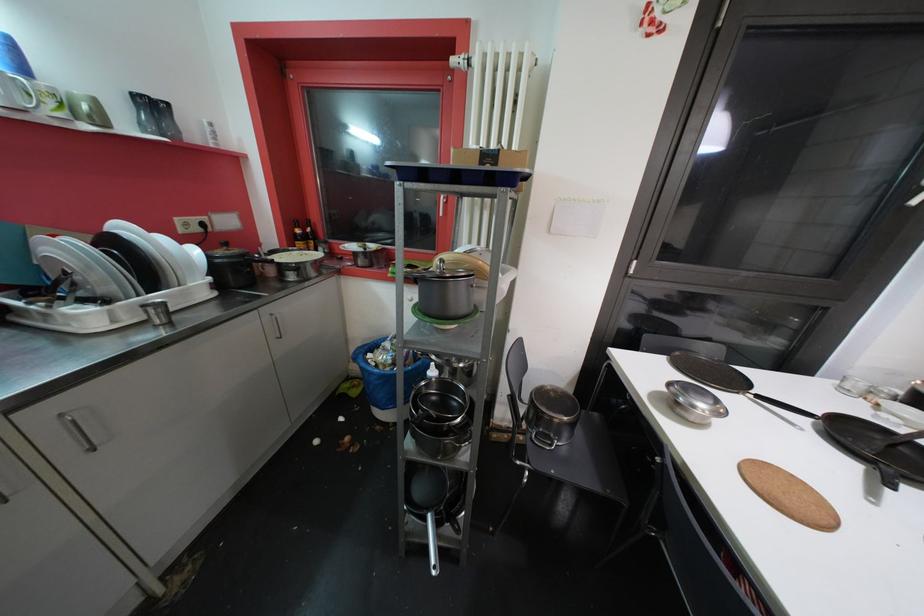
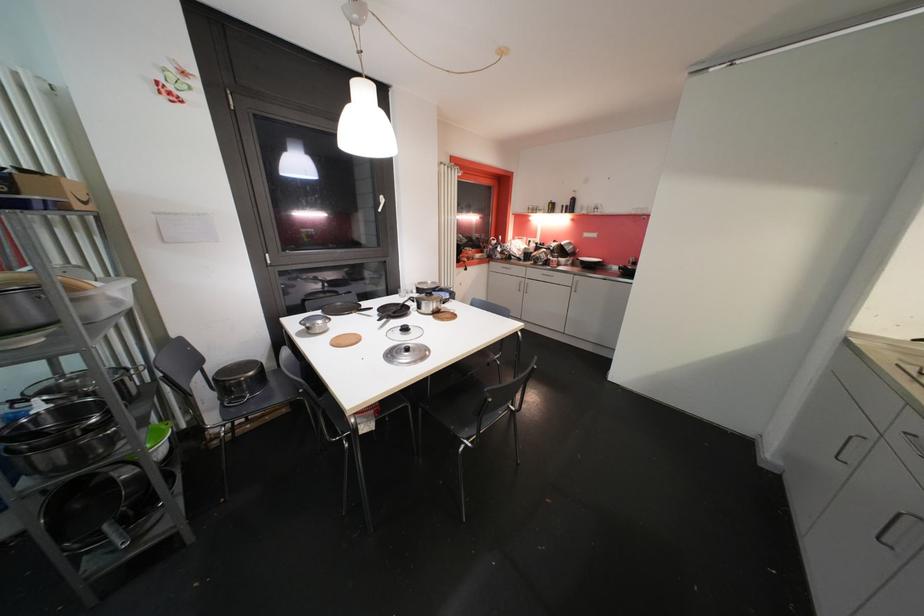
Where in the second image is the point corresponding to [433,517] from the first image?

(111, 529)